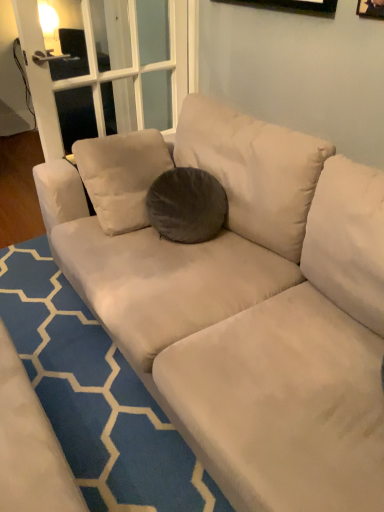
Question: Is wooden frame at upper right bigger or smaller than dark gray velvety pillow at center?

Choices:
 (A) small
 (B) big

Answer: (A)

Question: Is wooden frame at upper right taller or shorter than dark gray velvety pillow at center?

Choices:
 (A) short
 (B) tall

Answer: (A)

Question: Based on their relative distances, which object is farther from the blue textured rug at center?

Choices:
 (A) dark gray velvety pillow at center
 (B) wooden frame at upper right

Answer: (B)

Question: Which object is the closest to the blue textured rug at center?

Choices:
 (A) wooden frame at upper right
 (B) dark gray velvety pillow at center

Answer: (B)